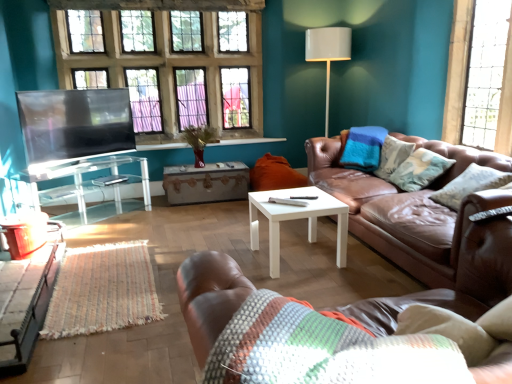
Question: Would you say white glossy coffee table at center is inside or outside white glossy floor lamp at upper right?

Choices:
 (A) outside
 (B) inside

Answer: (A)

Question: From the image's perspective, is white glossy coffee table at center positioned above or below white glossy floor lamp at upper right?

Choices:
 (A) below
 (B) above

Answer: (A)

Question: Which of these objects is positioned closest to the orange fabric pillow at center, marked as the 2th pillow in a right-to-left arrangement?

Choices:
 (A) wooden textured table at lower left, the third table viewed from the back
 (B) textured beige pillow at right, the first pillow when ordered from right to left
 (C) clear glass window at upper right, which appears as the first window when viewed from the right
 (D) flat matte screen at left
 (E) white glossy floor lamp at upper right

Answer: (E)

Question: Which object is positioned farthest from the wooden chest at center, acting as the 3th table starting from the front?

Choices:
 (A) orange fabric pillow at center, which is counted as the 1th pillow, starting from the back
 (B) clear glass windows at upper left, acting as the first window starting from the back
 (C) brown leather couch at right, which is the second studio couch from left to right
 (D) brown leather couch at lower right, which is the 1th studio couch in left-to-right order
 (E) clear glass window at upper right, acting as the second window starting from the back

Answer: (D)